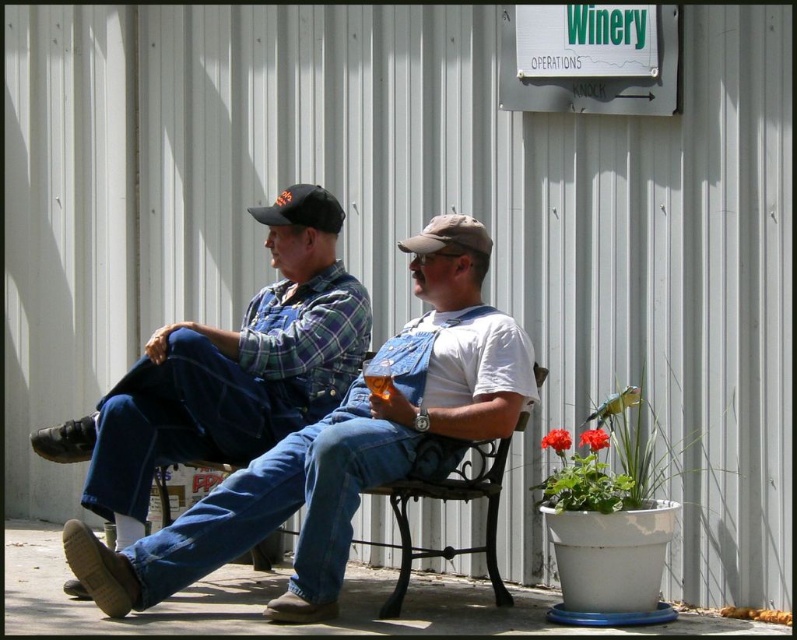
You are a photographer trying to capture a candid shot of the two men sitting on the bench outside the winery. You want to ensure that both the denim overalls at center and the tan fabric baseball cap at center are clearly visible in the frame. Based on their positions, which object should you focus on first to ensure both are in focus?

The denim overalls at center is to the left of the tan fabric baseball cap at center. Since the denim overalls at center is closer to the left, focusing on it first would help ensure both objects remain in focus as they are positioned side by side.

You are a visitor at the Winery Operations building and see the metallic brown bench at center and the black fabric baseball cap at upper center. Which object is positioned higher from the ground?

The black fabric baseball cap at upper center is positioned higher from the ground than the metallic brown bench at center because it is above it.